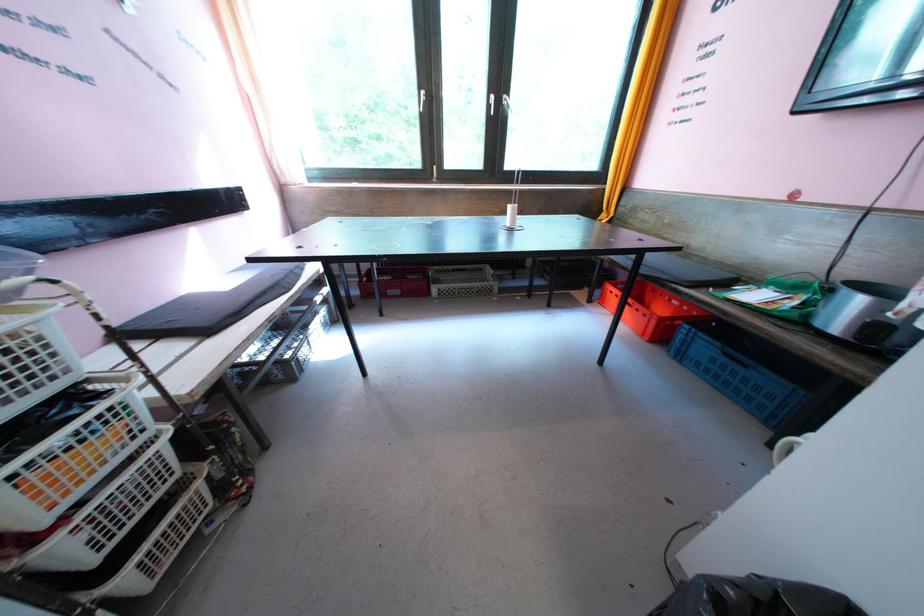
The height and width of the screenshot is (616, 924). Describe the element at coordinates (735, 375) in the screenshot. I see `the blue plastic crate` at that location.